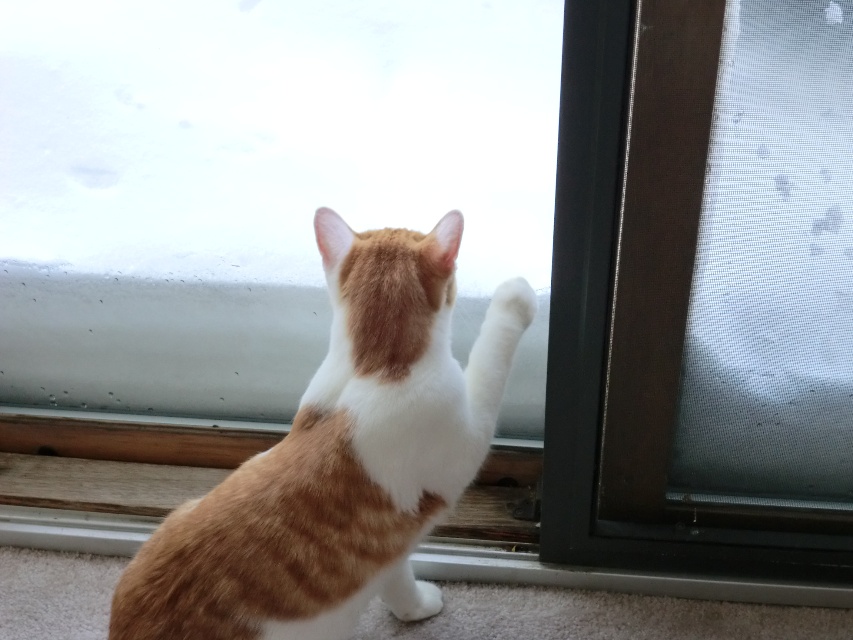
Question: Can you confirm if screen mesh at right is thinner than orange tabby cat at center?

Choices:
 (A) yes
 (B) no

Answer: (A)

Question: Which object appears closest to the camera in this image?

Choices:
 (A) orange tabby cat at center
 (B) screen mesh at right

Answer: (A)

Question: Does screen mesh at right appear on the right side of orange tabby cat at center?

Choices:
 (A) no
 (B) yes

Answer: (B)

Question: Can you confirm if screen mesh at right is positioned below orange tabby cat at center?

Choices:
 (A) yes
 (B) no

Answer: (B)

Question: Which point is closer to the camera?

Choices:
 (A) screen mesh at right
 (B) orange tabby cat at center

Answer: (B)